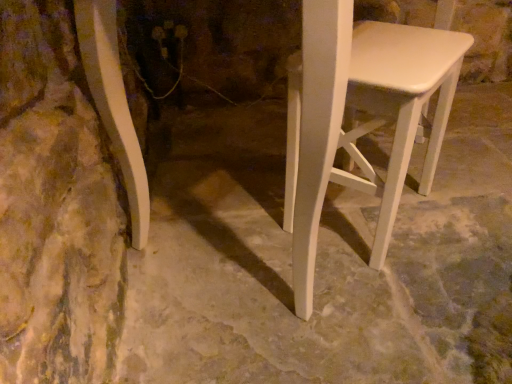
This screenshot has width=512, height=384. Find the location of `empty space that is ontop of white matte stool at right (from a real-world perspective)`. empty space that is ontop of white matte stool at right (from a real-world perspective) is located at coordinates (395, 48).